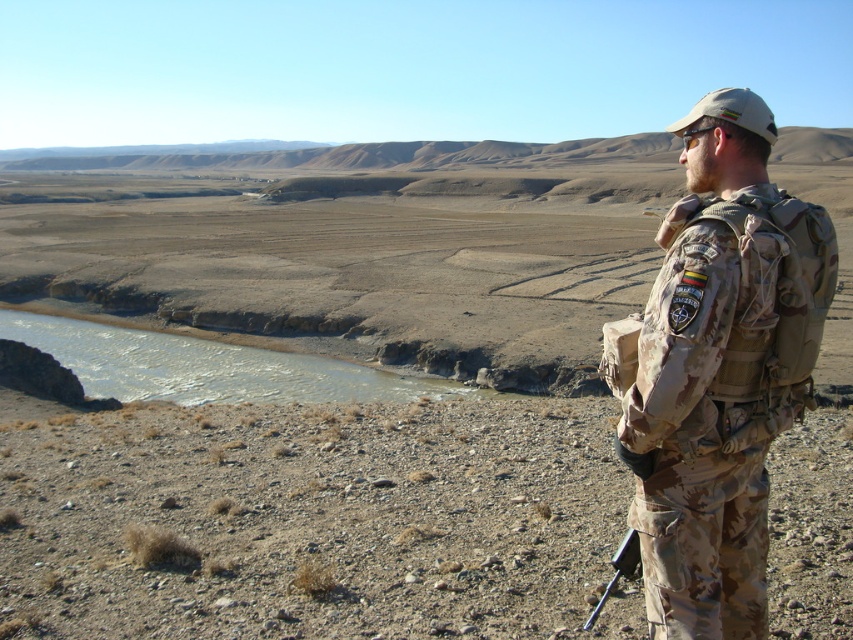
Is camouflage uniform at right taller than black plastic rifle at lower right?

Yes, camouflage uniform at right is taller than black plastic rifle at lower right.

Is camouflage uniform at right positioned before black plastic rifle at lower right?

That is True.

Identify the location of camouflage uniform at right. (721, 371).

The height and width of the screenshot is (640, 853). I want to click on camouflage uniform at right, so click(x=721, y=371).